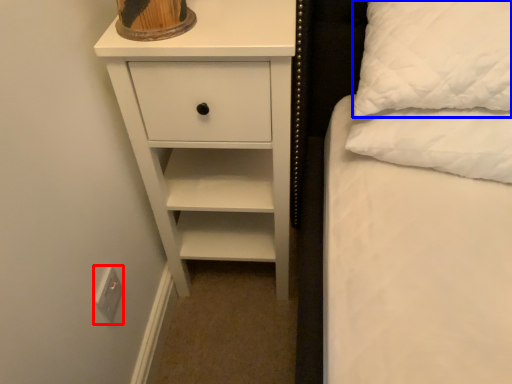
Question: Which point is closer to the camera, electric outlet (highlighted by a red box) or pillow (highlighted by a blue box)?

Choices:
 (A) electric outlet
 (B) pillow

Answer: (B)